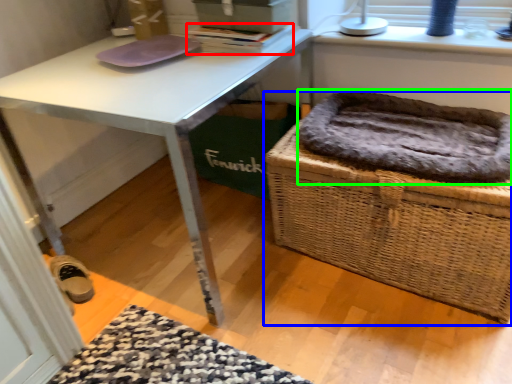
Question: Which object is positioned closest to book (highlighted by a red box)? Select from picnic basket (highlighted by a blue box) and cat bed (highlighted by a green box).

Choices:
 (A) picnic basket
 (B) cat bed

Answer: (B)